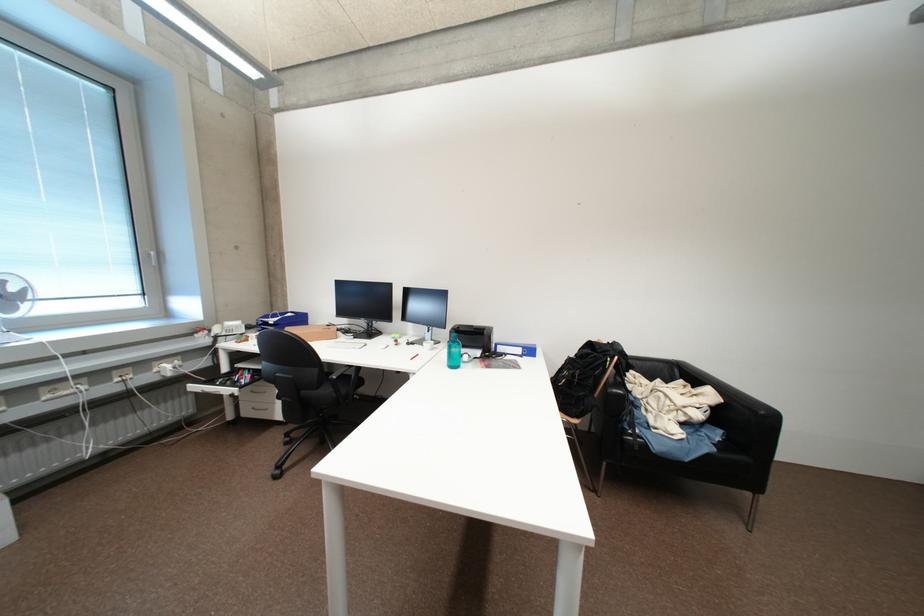
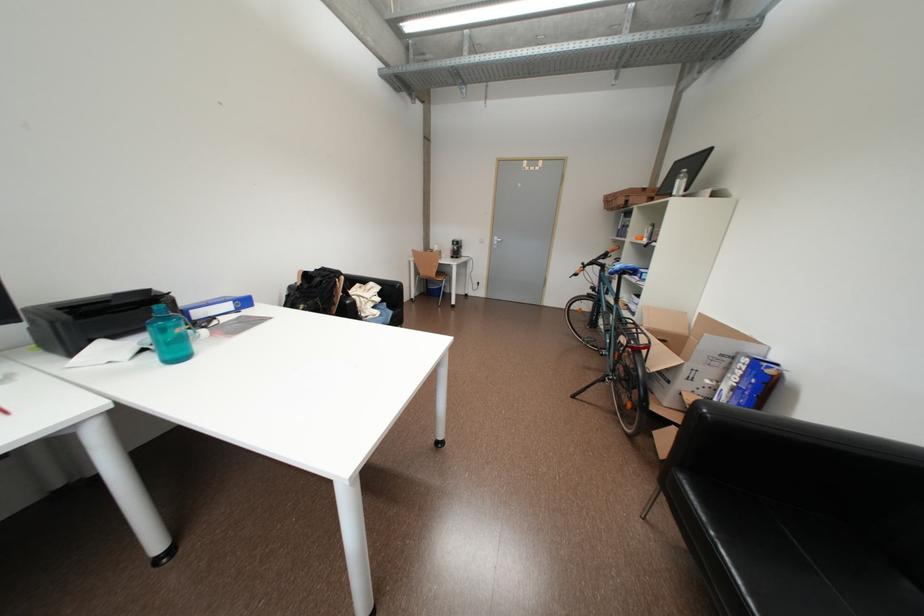
Where in the second image is the point corresponding to point 538,354 from the first image?

(252, 304)